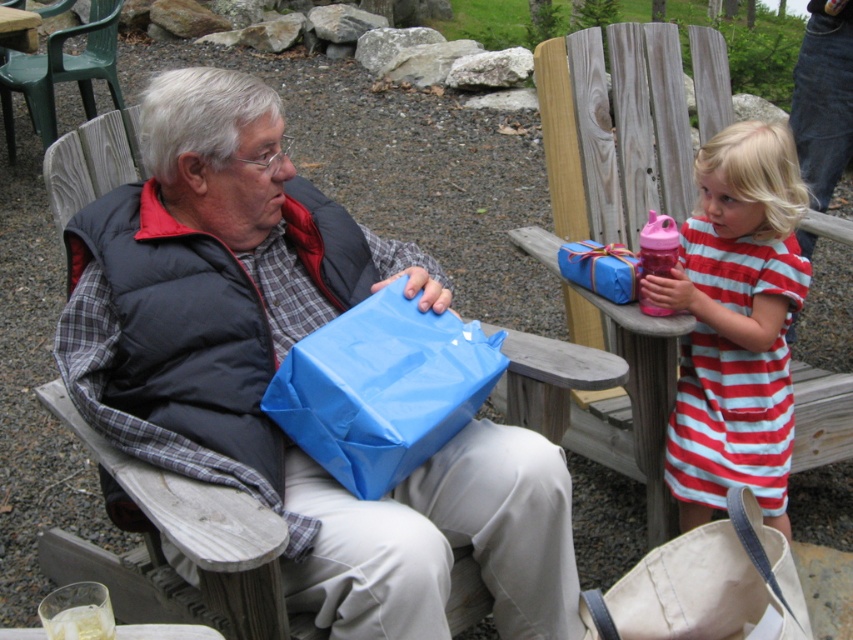
You are standing at the origin point of the image. Which direction should you move to reach the wooden chair at center?

The wooden chair at center is located at point 0.831 in the x direction and 0.238 in the y direction. Since you are at the origin, you should move towards the right and slightly downward to reach it.

You are a delivery person who needs to place a small package on the wooden chair at center. The package is 10 cm tall. Can the blue matte gift at upper center fit underneath it without being crushed?

The wooden chair at center is taller than the blue matte gift at upper center, so placing the package on the chair would leave enough space for the gift to be placed underneath without being crushed.